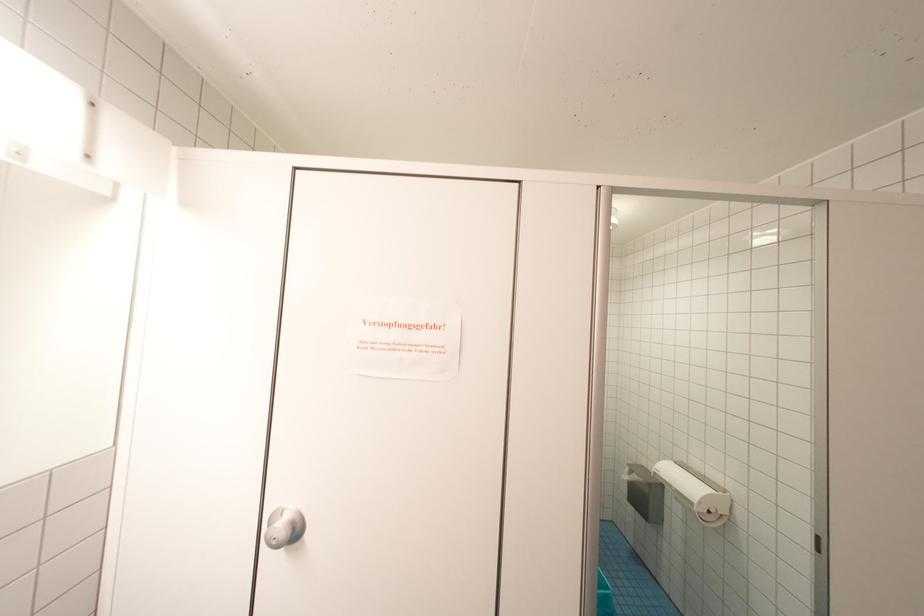
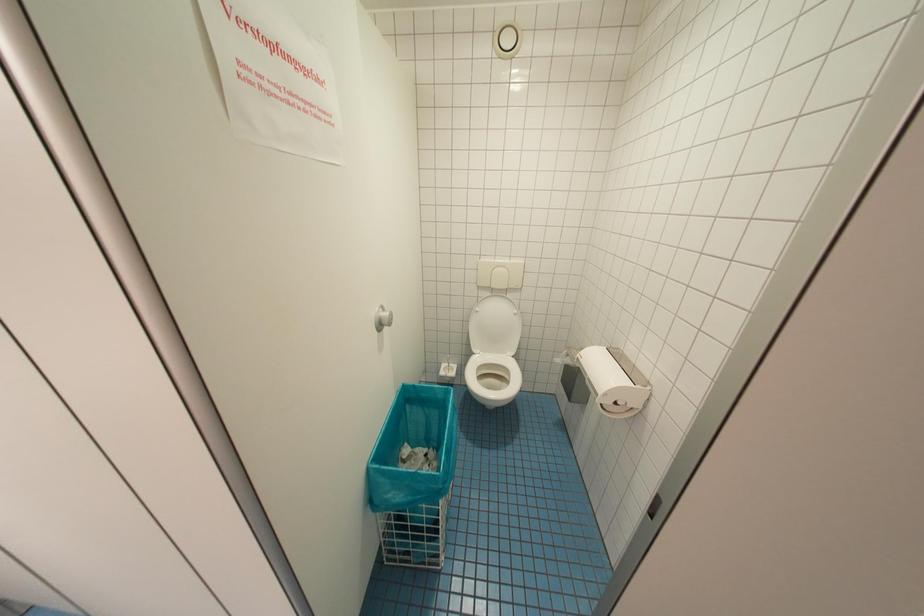
Which direction would the cameraman need to move to produce the second image?

The cameraman walked toward right, forward.